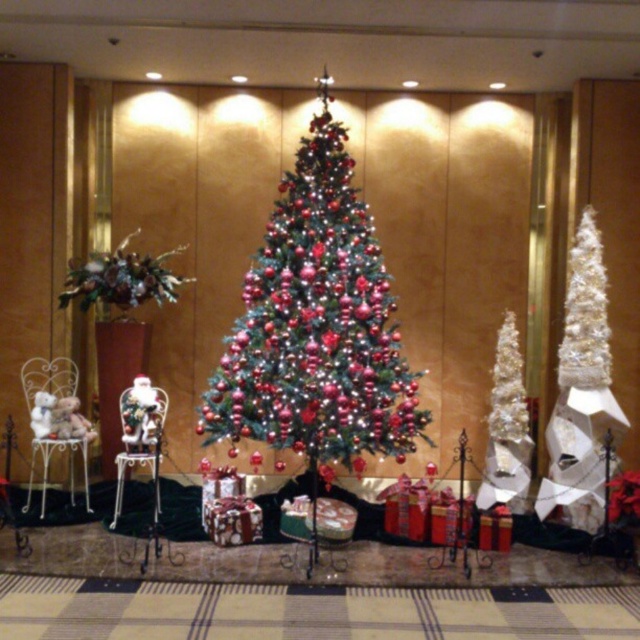
Question: Can you confirm if white metallic chair at left is positioned to the left of white glittery christmas tree at right?

Choices:
 (A) no
 (B) yes

Answer: (B)

Question: Can you confirm if white metal chair at left is positioned below white metallic chair at left?

Choices:
 (A) yes
 (B) no

Answer: (A)

Question: Can you confirm if shiny green christmas tree at center is positioned to the left of white metallic chair at left?

Choices:
 (A) no
 (B) yes

Answer: (A)

Question: Estimate the real-world distances between objects in this image. Which object is closer to the white glittery christmas tree at right?

Choices:
 (A) shiny green christmas tree at center
 (B) white metallic chair at left

Answer: (A)

Question: Estimate the real-world distances between objects in this image. Which object is farther from the white glittery christmas tree at right?

Choices:
 (A) shiny green christmas tree at center
 (B) white metal chair at left

Answer: (B)

Question: Which is nearer to the white metallic chair at left?

Choices:
 (A) white metal chair at left
 (B) shiny green christmas tree at center

Answer: (A)